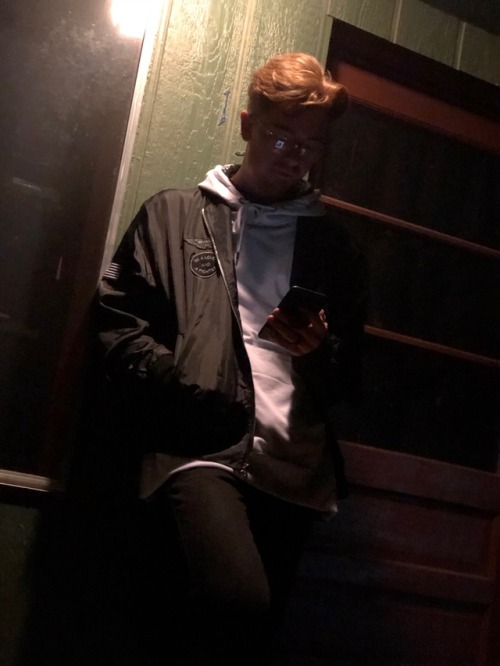
Identify the location of door. (40, 246).